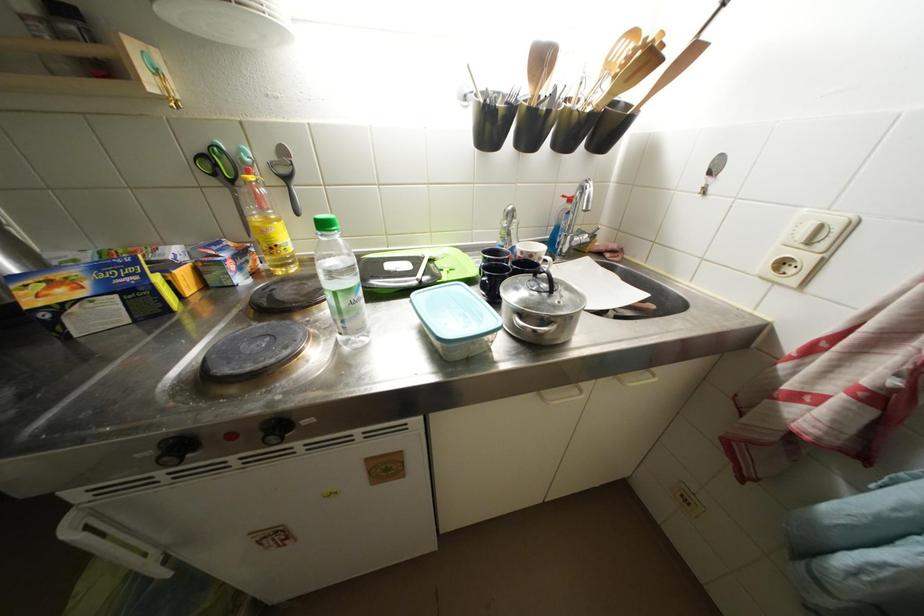
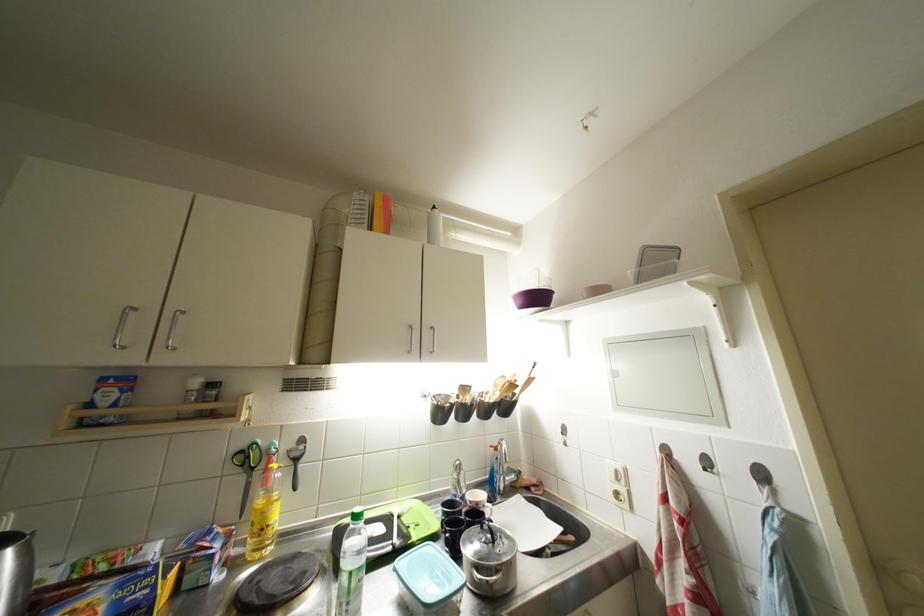
Where in the second image is the point corresponding to point (282, 161) from the first image?

(299, 450)